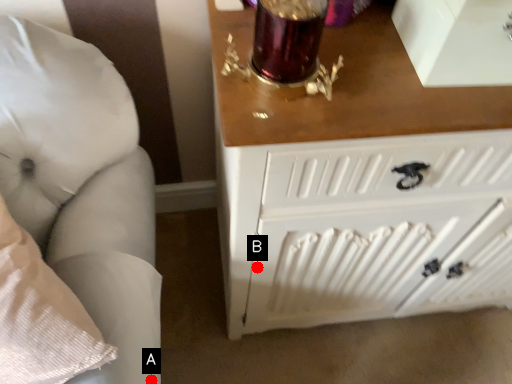
Question: Two points are circled on the image, labeled by A and B beside each circle. Which of the following is the closest to the observer?

Choices:
 (A) A is closer
 (B) B is closer

Answer: (A)